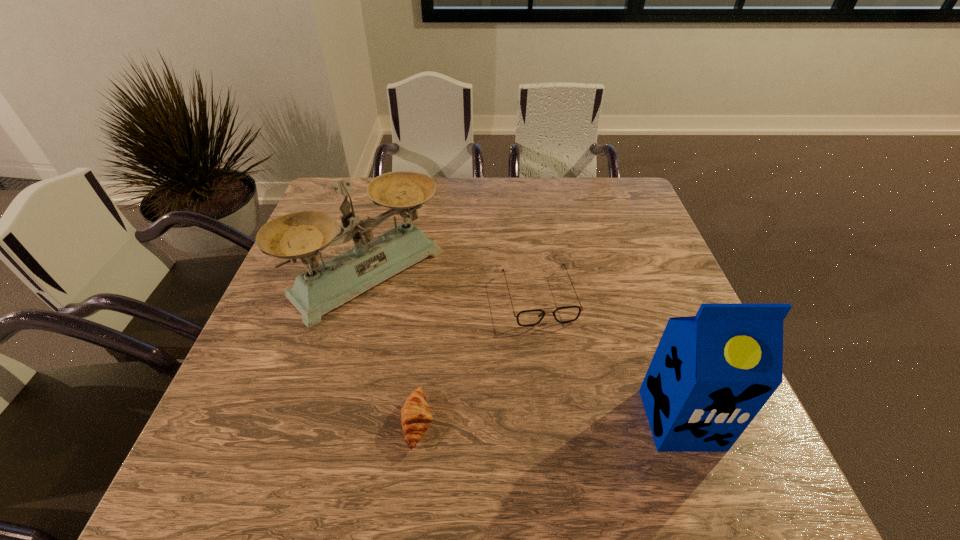
This screenshot has width=960, height=540. In order to click on free spot at the near left corner of the desktop in this screenshot , I will do `click(220, 420)`.

Find the location of a particular element. The width and height of the screenshot is (960, 540). blank area at the far right corner is located at coordinates (644, 217).

Find the location of a particular element. This screenshot has width=960, height=540. free space between the second tallest object and the second object from right to left is located at coordinates pos(454,286).

In order to click on vacant area between the pastry and the scale in this screenshot , I will do `click(394, 348)`.

Identify the location of vacant space in between the sunglasses and the scale. The image size is (960, 540). (454, 286).

You are a GUI agent. You are given a task and a screenshot of the screen. Output one action in this format:
    pyautogui.click(x=<x>, y=<y>)
    Task: Click on the vacant point located between the sunglasses and the pastry
    The image size is (960, 540).
    Given the screenshot: What is the action you would take?
    pyautogui.click(x=478, y=360)

At what (x,y) coordinates should I click in order to perform the action: click on vacant space in between the sunglasses and the carton. Please return your answer as a coordinate pair (x, y). The width and height of the screenshot is (960, 540). Looking at the image, I should click on (610, 359).

Where is `vacant area that lies between the third shortest object and the shortest object`? This screenshot has height=540, width=960. vacant area that lies between the third shortest object and the shortest object is located at coordinates (394, 348).

Where is `free point between the carton and the shortest object`? free point between the carton and the shortest object is located at coordinates (549, 421).

Identify the location of free space between the pastry and the rightmost object. The width and height of the screenshot is (960, 540). (549, 421).